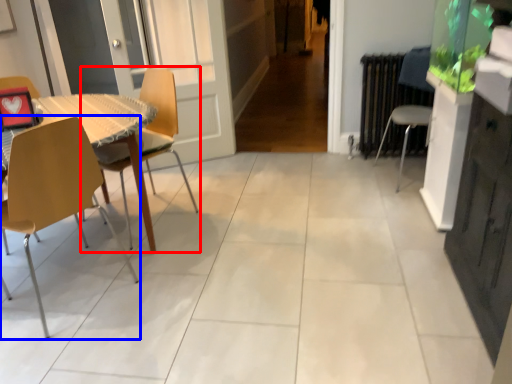
Question: Which point is further to the camera, chair (highlighted by a red box) or chair (highlighted by a blue box)?

Choices:
 (A) chair
 (B) chair

Answer: (A)